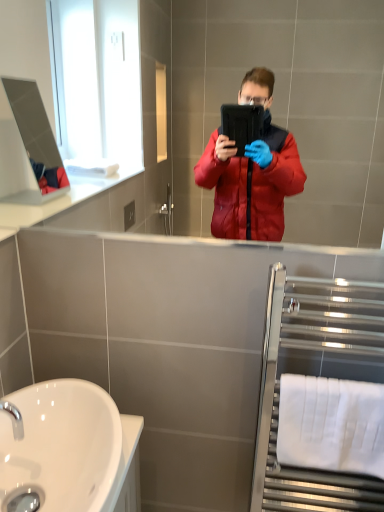
Question: From the image's perspective, is white glossy sink at lower left below chrome metallic tap at lower left?

Choices:
 (A) no
 (B) yes

Answer: (B)

Question: Can you confirm if white glossy sink at lower left is thinner than chrome metallic tap at lower left?

Choices:
 (A) no
 (B) yes

Answer: (A)

Question: Is white glossy sink at lower left not near chrome metallic tap at lower left?

Choices:
 (A) no
 (B) yes

Answer: (A)

Question: Can you confirm if white glossy sink at lower left is wider than chrome metallic tap at lower left?

Choices:
 (A) no
 (B) yes

Answer: (B)

Question: Can you confirm if white glossy sink at lower left is positioned to the left of chrome metallic tap at lower left?

Choices:
 (A) no
 (B) yes

Answer: (A)

Question: From the image's perspective, is white glossy sink at lower left located above chrome metallic tap at lower left?

Choices:
 (A) no
 (B) yes

Answer: (A)

Question: Is chrome metallic tap at lower left surrounded by polished chrome towel rack at right?

Choices:
 (A) no
 (B) yes

Answer: (A)

Question: Does polished chrome towel rack at right have a larger size compared to chrome metallic tap at lower left?

Choices:
 (A) no
 (B) yes

Answer: (B)

Question: Can you confirm if polished chrome towel rack at right is positioned to the right of chrome metallic tap at lower left?

Choices:
 (A) no
 (B) yes

Answer: (B)

Question: From a real-world perspective, is polished chrome towel rack at right over chrome metallic tap at lower left?

Choices:
 (A) no
 (B) yes

Answer: (A)

Question: Is polished chrome towel rack at right completely or partially outside of chrome metallic tap at lower left?

Choices:
 (A) yes
 (B) no

Answer: (A)

Question: From a real-world perspective, is polished chrome towel rack at right below chrome metallic tap at lower left?

Choices:
 (A) yes
 (B) no

Answer: (A)

Question: Does white fabric towel bar at lower right have a greater height compared to white glossy sink at lower left?

Choices:
 (A) yes
 (B) no

Answer: (A)